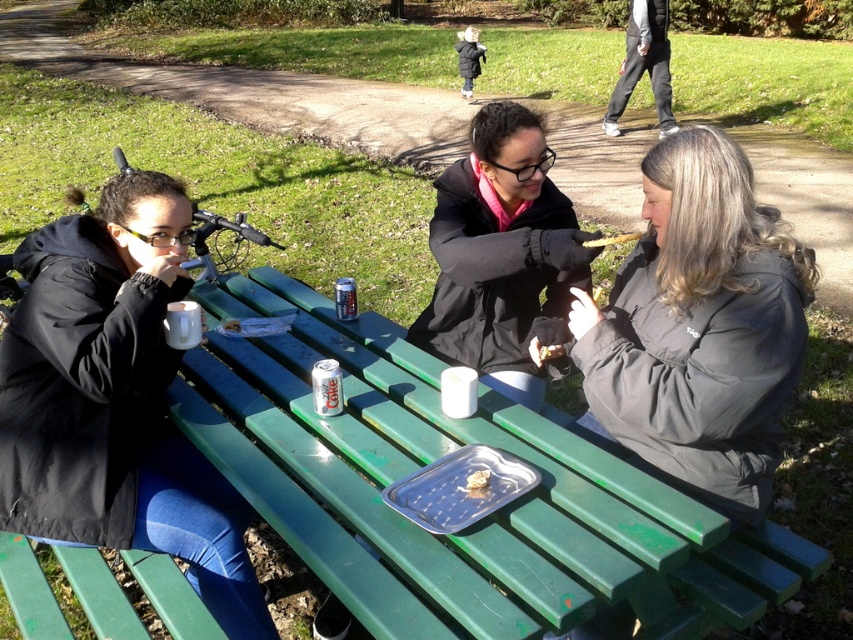
Is gray matte jacket at center to the left of white matte paper at center from the viewer's perspective?

In fact, gray matte jacket at center is to the right of white matte paper at center.

Is gray matte jacket at center taller than white matte paper at center?

Yes, gray matte jacket at center is taller than white matte paper at center.

Is point (595, 355) farther from camera compared to point (231, 324)?

No, it is in front of (231, 324).

Identify the location of gray matte jacket at center. This screenshot has width=853, height=640. (699, 326).

Between green wood picnic table at center and white ceramic mug at left, which one has less height?

Standing shorter between the two is white ceramic mug at left.

Can you confirm if green wood picnic table at center is wider than white ceramic mug at left?

Yes, green wood picnic table at center is wider than white ceramic mug at left.

What are the coordinates of `green wood picnic table at center` in the screenshot? It's located at (416, 468).

Between silver metallic can at center and black puffer jacket at upper center, which one is positioned lower?

silver metallic can at center is lower down.

Which is in front, point (329, 362) or point (476, 65)?

Point (329, 362) is more forward.

Which is behind, point (329, 397) or point (466, 51)?

The point (466, 51) is more distant.

You are a GUI agent. You are given a task and a screenshot of the screen. Output one action in this format:
    pyautogui.click(x=<x>, y=<y>)
    Task: Click on the silver metallic can at center
    The height and width of the screenshot is (640, 853).
    Given the screenshot: What is the action you would take?
    pyautogui.click(x=326, y=387)